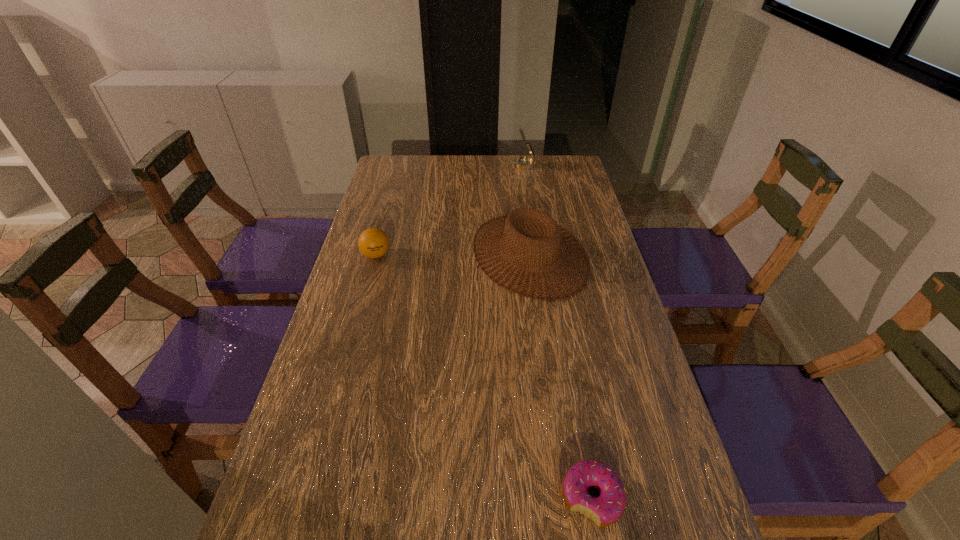
The width and height of the screenshot is (960, 540). Identify the location of sunhat. (528, 222).

At what (x,y) coordinates should I click in order to perform the action: click on the farthest object. Please return your answer as a coordinate pair (x, y). The width and height of the screenshot is (960, 540). Looking at the image, I should click on (525, 163).

Where is `ping-pong ball`? Image resolution: width=960 pixels, height=540 pixels. ping-pong ball is located at coordinates (373, 242).

Image resolution: width=960 pixels, height=540 pixels. What are the coordinates of `the nearest object` in the screenshot? It's located at (606, 509).

Find the location of `the shortest object`. the shortest object is located at coordinates (606, 509).

This screenshot has height=540, width=960. I want to click on vacant area situated 0.300m on the left of the sunhat, so click(377, 254).

Locate an element on the screen. vacant space located with the dial facing the farthest object is located at coordinates point(414,165).

I want to click on vacant space situated 0.110m with the dial facing the farthest object, so click(x=485, y=165).

Where is `vacant point located with the dial facing the farthest object`? This screenshot has width=960, height=540. vacant point located with the dial facing the farthest object is located at coordinates (492, 165).

Image resolution: width=960 pixels, height=540 pixels. I want to click on vacant space located 0.390m on the side with brand of the ping-pong ball, so point(345,370).